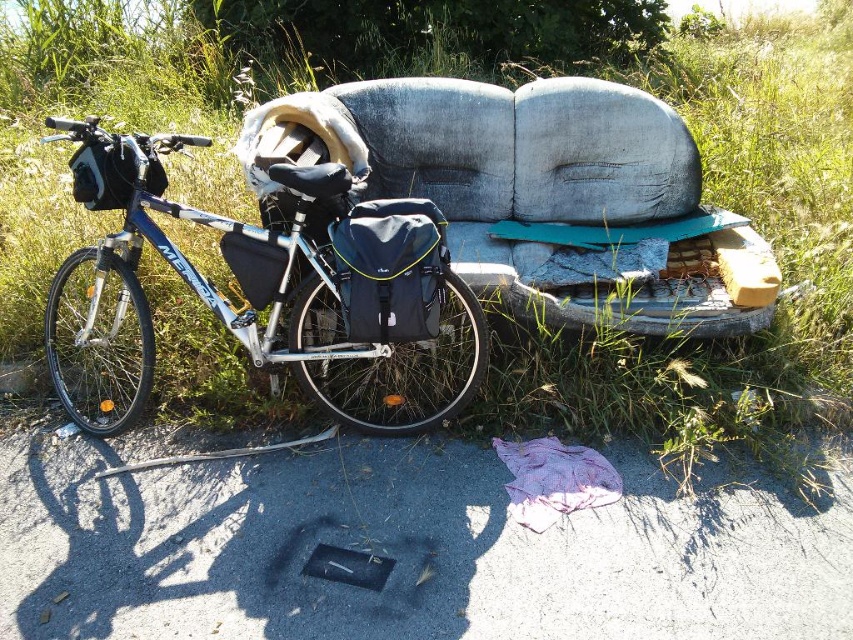
Question: Which object is farther from the camera taking this photo?

Choices:
 (A) blue metallic bicycle at left
 (B) worn fabric couch at center

Answer: (B)

Question: Which point is closer to the camera taking this photo?

Choices:
 (A) (614, 180)
 (B) (90, 353)
 (C) (525, 104)

Answer: (B)

Question: Among these points, which one is farthest from the camera?

Choices:
 (A) pos(659,234)
 (B) pos(123,412)

Answer: (A)

Question: Does worn fabric couch at center have a lesser width compared to blue metallic bicycle at left?

Choices:
 (A) yes
 (B) no

Answer: (B)

Question: Is green grass at upper left positioned in front of blue metallic bicycle at left?

Choices:
 (A) yes
 (B) no

Answer: (B)

Question: In this image, where is worn fabric couch at center located relative to blue metallic bicycle at left?

Choices:
 (A) above
 (B) below

Answer: (A)